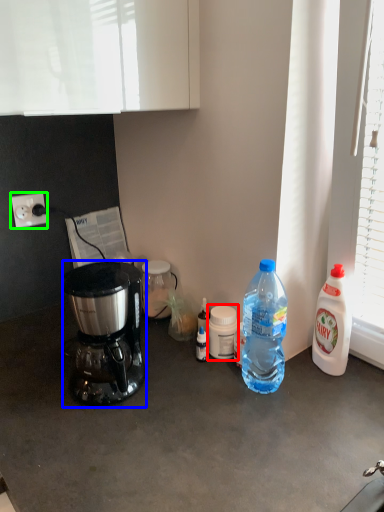
Question: Which object is positioned farthest from bottle (highlighted by a red box)? Select from coffee maker (highlighted by a blue box) and power outlet (highlighted by a green box).

Choices:
 (A) coffee maker
 (B) power outlet

Answer: (B)